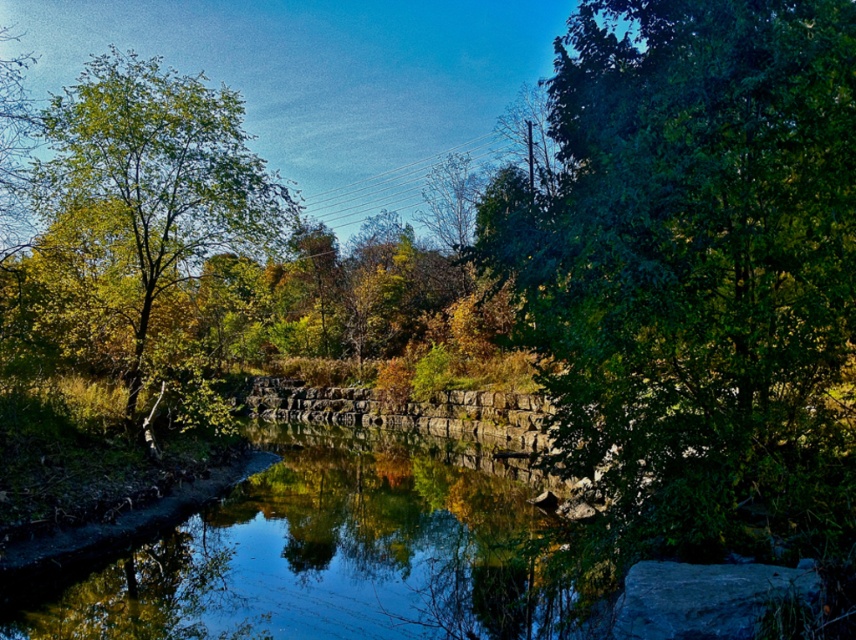
Question: Which point is closer to the camera?

Choices:
 (A) green leafy tree at upper right
 (B) clear water at center
 (C) green leafy tree at left

Answer: (A)

Question: Which point is farther from the camera taking this photo?

Choices:
 (A) (16, 609)
 (B) (171, 81)
 (C) (664, 76)

Answer: (B)

Question: Which is nearer to the clear water at center?

Choices:
 (A) green leafy tree at left
 (B) green leafy tree at upper right

Answer: (B)

Question: Does green leafy tree at upper right have a greater width compared to green leafy tree at left?

Choices:
 (A) yes
 (B) no

Answer: (B)

Question: Observing the image, what is the correct spatial positioning of green leafy tree at upper right in reference to green leafy tree at left?

Choices:
 (A) left
 (B) right

Answer: (B)

Question: From the image, what is the correct spatial relationship of green leafy tree at upper right in relation to green leafy tree at left?

Choices:
 (A) right
 (B) left

Answer: (A)